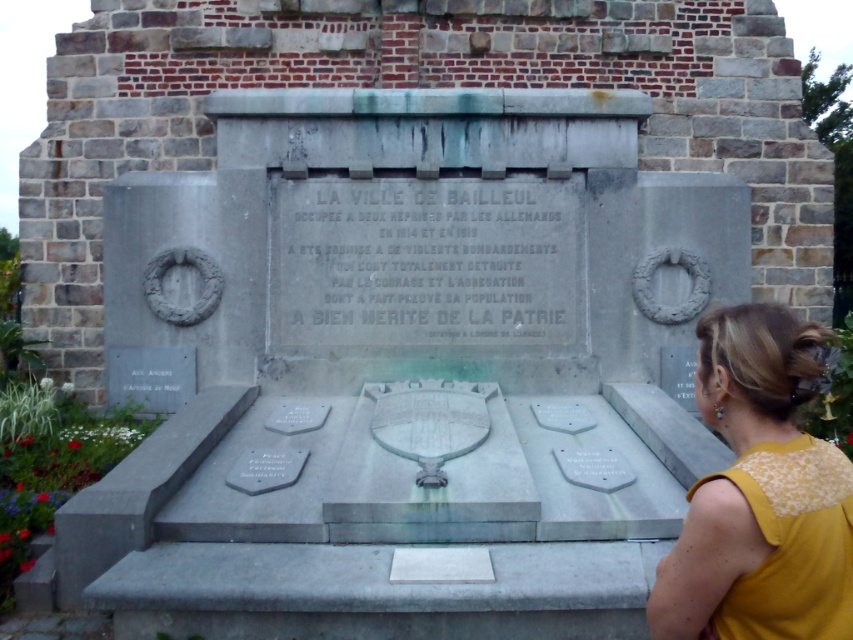
Based on the photo, who is more forward, (645,198) or (798,609)?

Point (798,609) is more forward.

Consider the image. Which is below, polished stone plaque at center or yellow fabric at right?

yellow fabric at right is lower down.

In order to click on polished stone plaque at center in this screenshot , I will do `click(407, 368)`.

At what (x,y) coordinates should I click in order to perform the action: click on polished stone plaque at center. Please return your answer as a coordinate pair (x, y). The height and width of the screenshot is (640, 853). Looking at the image, I should click on (407, 368).